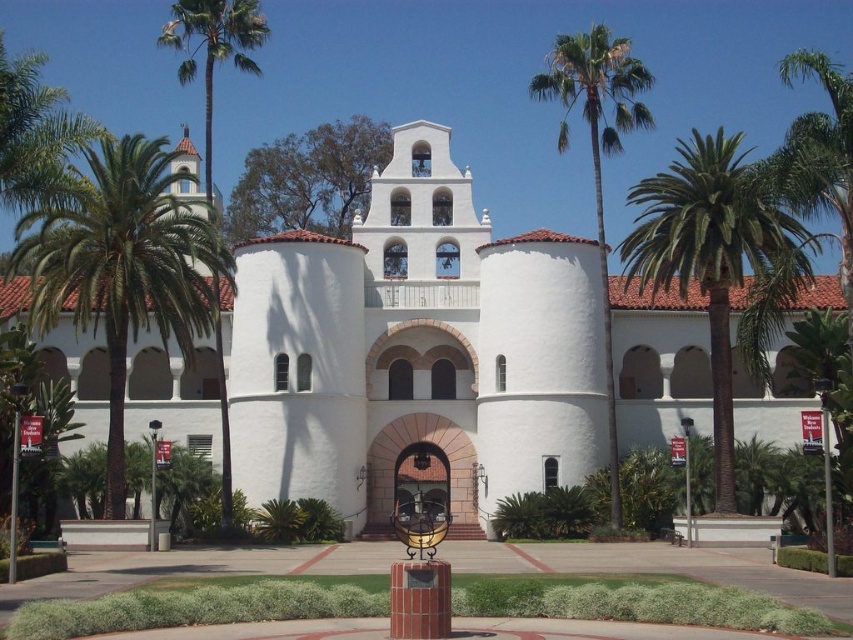
You are standing in front of the white stucco building at center and want to take a photo of the green leafy palm tree at left. Which direction should you turn to ensure the palm tree is fully visible in the frame without any obstruction?

You should turn to the left side of the white stucco building at center to ensure the green leafy palm tree at left is fully visible without obstruction, as the palm tree is positioned behind the building and moving to the side would provide an unobstructed view.